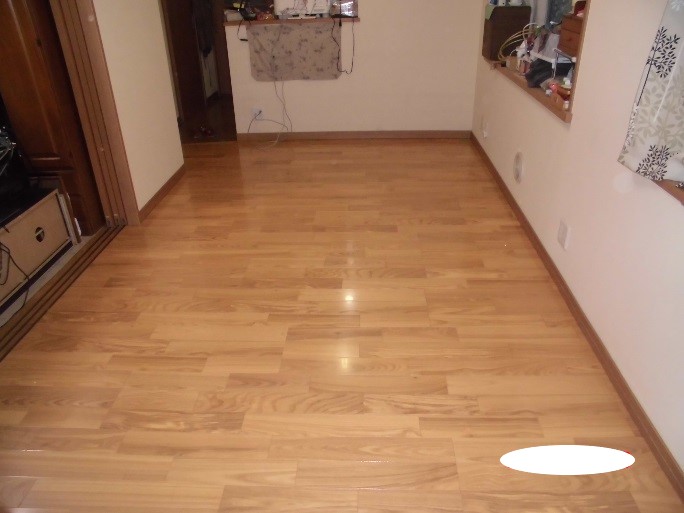
Locate an element on the screen. trim is located at coordinates (122, 177).